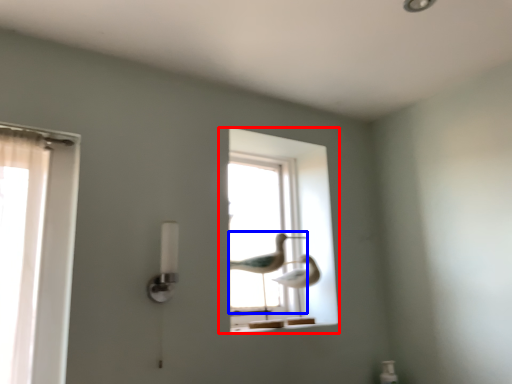
Question: Which of the following is the closest to the observer, window (highlighted by a red box) or bird (highlighted by a blue box)?

Choices:
 (A) window
 (B) bird

Answer: (B)